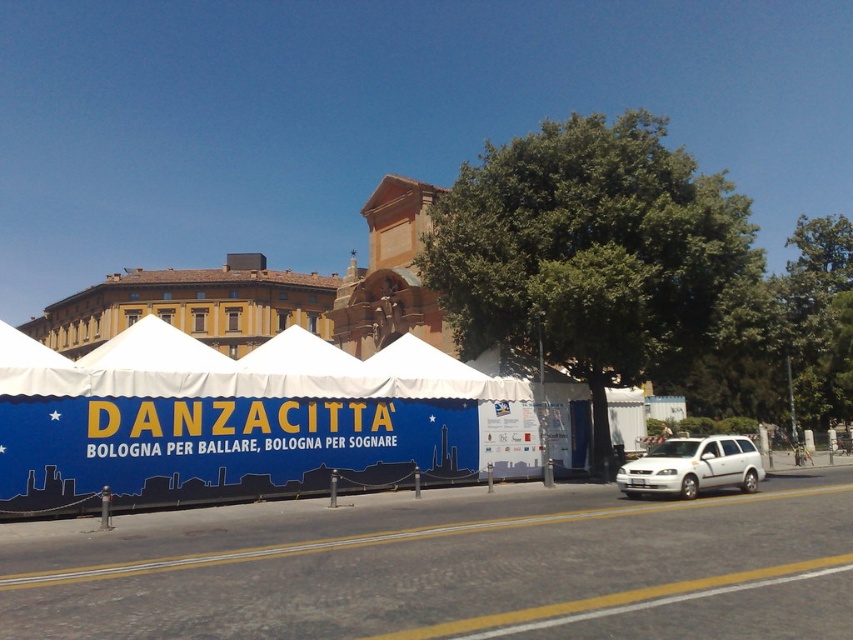
Between blue fabric tent at center and white matte van at lower right, which one is positioned higher?

blue fabric tent at center

Does blue fabric tent at center have a greater height compared to white matte van at lower right?

Yes, blue fabric tent at center is taller than white matte van at lower right.

Who is more distant from viewer, (151,499) or (740,467)?

Positioned behind is point (740,467).

Locate an element on the screen. This screenshot has width=853, height=640. blue fabric tent at center is located at coordinates (228, 419).